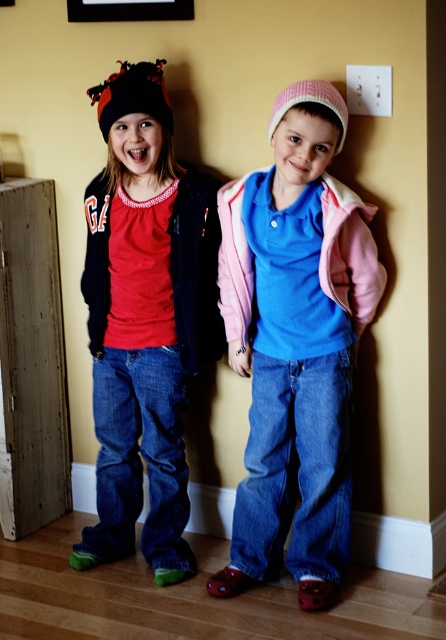
Is matte black beanie at left above black plastic picture frame at upper center?

No.

Find the location of a particular element. The image size is (446, 640). matte black beanie at left is located at coordinates [x=144, y=320].

Measure the distance between point (284, 371) and camera.

Point (284, 371) is 2.57 meters away from camera.

You are a GUI agent. You are given a task and a screenshot of the screen. Output one action in this format:
    pyautogui.click(x=<x>, y=<y>)
    Task: Click on the pink fleece jacket at center
    Image resolution: width=446 pixels, height=640 pixels.
    Given the screenshot: What is the action you would take?
    pyautogui.click(x=296, y=344)

This screenshot has height=640, width=446. Describe the element at coordinates (296, 344) in the screenshot. I see `pink fleece jacket at center` at that location.

The width and height of the screenshot is (446, 640). Identify the location of pink fleece jacket at center. (296, 344).

Locate an element on the screen. pink fleece jacket at center is located at coordinates (296, 344).

Between pink fleece jacket at center and black plastic picture frame at upper center, which one is positioned lower?

pink fleece jacket at center is lower down.

I want to click on pink fleece jacket at center, so pyautogui.click(x=296, y=344).